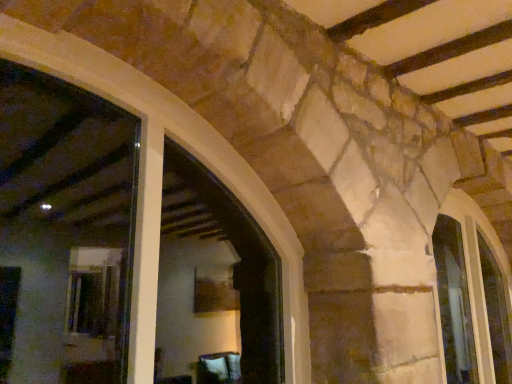
Question: From the image's perspective, is clear glass window at right, arranged as the first window when viewed from the right, above or below clear glass window at center-right, the 2th window when ordered from right to left?

Choices:
 (A) above
 (B) below

Answer: (B)

Question: Do you think clear glass window at right, arranged as the first window when viewed from the right, is within clear glass window at center-right, the 1th window viewed from the left, or outside of it?

Choices:
 (A) outside
 (B) inside

Answer: (A)

Question: Relative to clear glass window at center-right, the 1th window viewed from the left, is clear glass window at right, positioned as the 2th window in left-to-right order, in front or behind?

Choices:
 (A) behind
 (B) front

Answer: (A)

Question: In the image, is clear glass window at center-right, the 2th window when ordered from right to left, positioned in front of or behind clear glass window at right, arranged as the first window when viewed from the right?

Choices:
 (A) behind
 (B) front

Answer: (B)

Question: Considering the positions of clear glass window at center-right, the 2th window when ordered from right to left, and clear glass window at right, arranged as the first window when viewed from the right, in the image, is clear glass window at center-right, the 2th window when ordered from right to left, bigger or smaller than clear glass window at right, arranged as the first window when viewed from the right,?

Choices:
 (A) big
 (B) small

Answer: (A)

Question: Is clear glass window at center-right, the 2th window when ordered from right to left, spatially inside clear glass window at right, arranged as the first window when viewed from the right, or outside of it?

Choices:
 (A) inside
 (B) outside

Answer: (B)

Question: Does point (444, 241) appear closer or farther from the camera than point (494, 279)?

Choices:
 (A) closer
 (B) farther

Answer: (B)